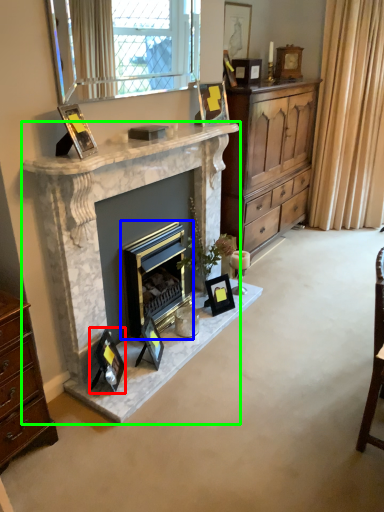
Question: Which is nearer to the picture frame (highlighted by a red box)? fireplace (highlighted by a blue box) or fireplace (highlighted by a green box).

Choices:
 (A) fireplace
 (B) fireplace

Answer: (A)